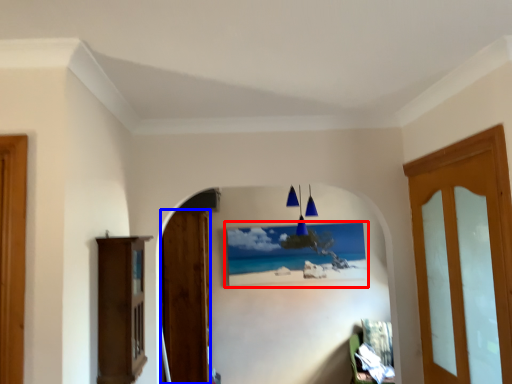
Question: Which object appears farthest to the camera in this image, picture frame (highlighted by a red box) or door (highlighted by a blue box)?

Choices:
 (A) picture frame
 (B) door

Answer: (A)